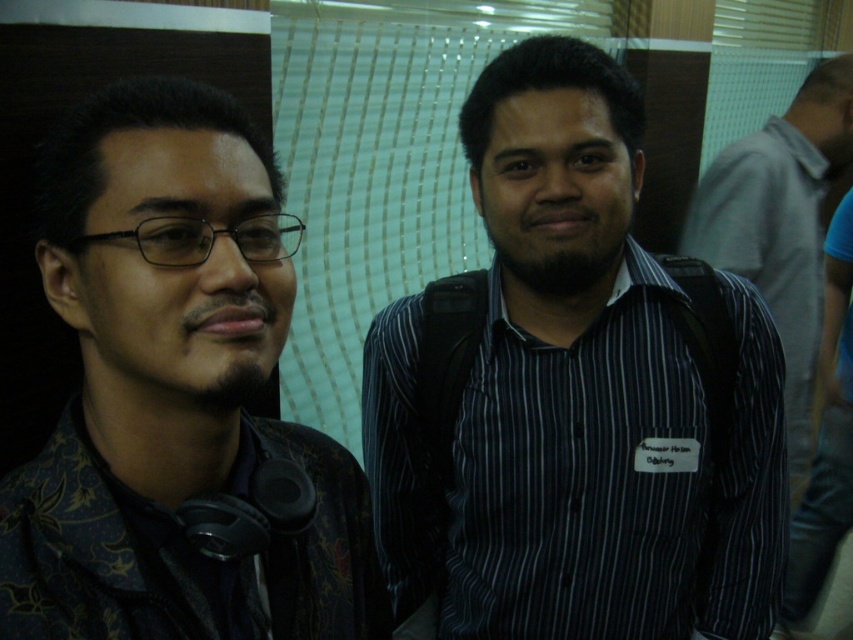
Question: Does matte black headphones at left appear over striped shirt at center?

Choices:
 (A) no
 (B) yes

Answer: (A)

Question: Which is nearer to the striped shirt at center?

Choices:
 (A) matte black headphones at left
 (B) dark striped shirt at center

Answer: (B)

Question: Based on their relative distances, which object is farther from the matte black headphones at left?

Choices:
 (A) dark striped shirt at center
 (B) striped shirt at center

Answer: (B)

Question: Is dark striped shirt at center in front of matte black headphones at left?

Choices:
 (A) yes
 (B) no

Answer: (B)

Question: Can you confirm if matte black headphones at left is wider than striped shirt at center?

Choices:
 (A) no
 (B) yes

Answer: (A)

Question: Considering the real-world distances, which object is closest to the dark striped shirt at center?

Choices:
 (A) matte black headphones at left
 (B) striped shirt at center

Answer: (A)